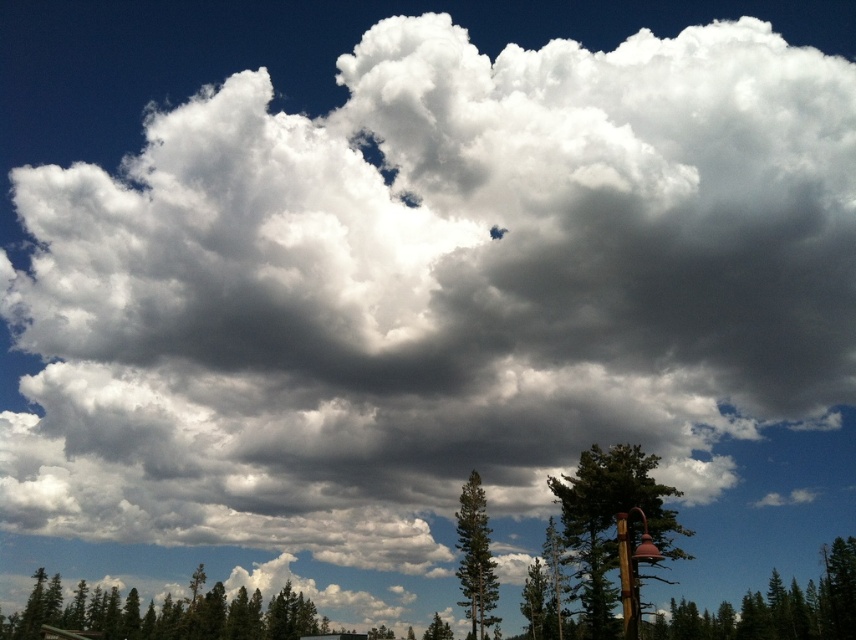
You are standing in a forest and see the green matte tree at lower right and the green textured tree at center. Which tree is positioned more to the right side?

The green textured tree at center is positioned more to the right side since the green matte tree at lower right is to the left of it.

You are standing at the center of the image and want to walk towards the green matte tree at lower right. Which direction should you head in?

You should head towards the lower right direction to reach the green matte tree at lower right since it is located at point (614, 531).